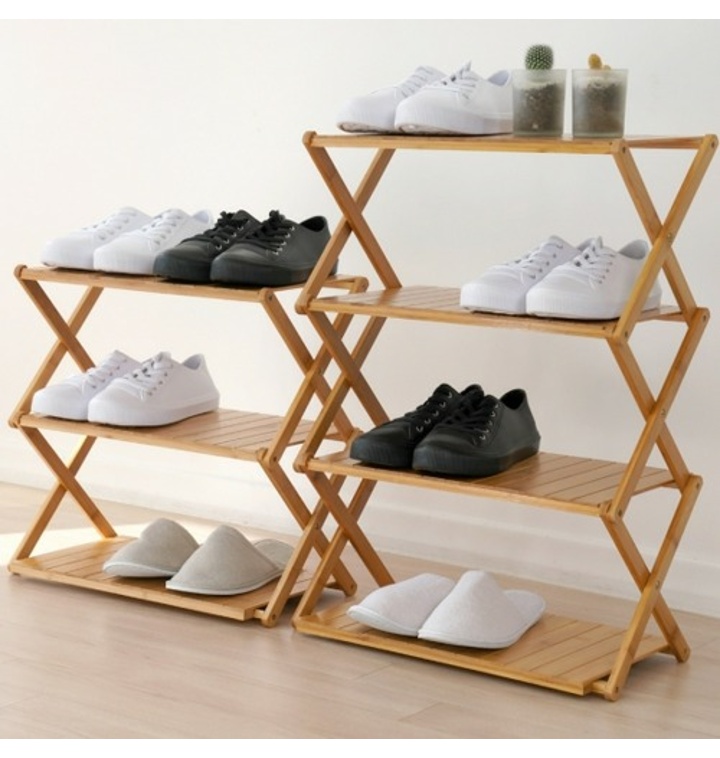
Where is `slippers`? This screenshot has width=720, height=758. slippers is located at coordinates point(150,540), point(212,562), point(386,594), point(466,614).